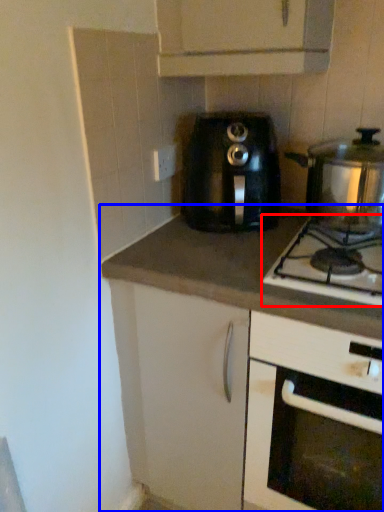
Question: Among these objects, which one is farthest to the camera, gas stove (highlighted by a red box) or countertop (highlighted by a blue box)?

Choices:
 (A) gas stove
 (B) countertop

Answer: (B)